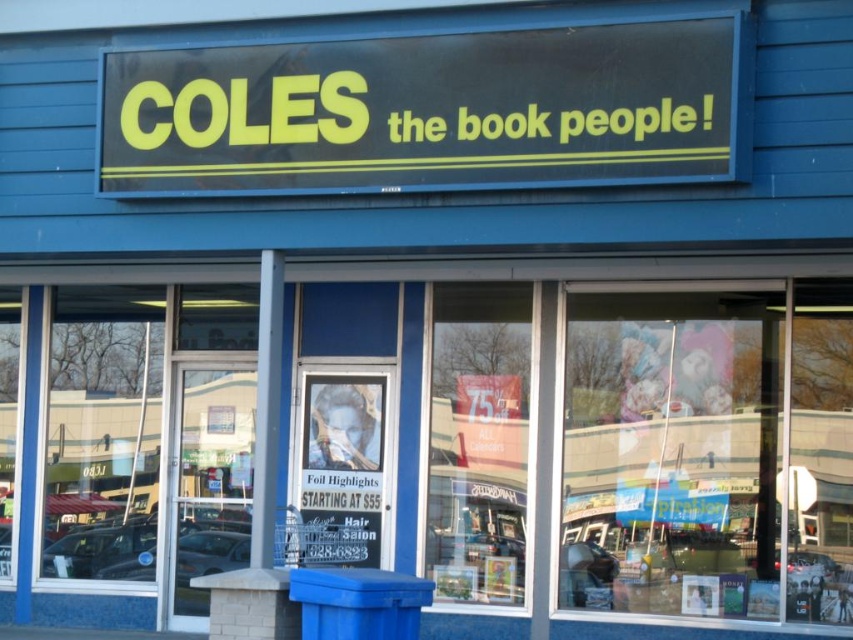
How much distance is there between transparent glass window at center and metallic poster at center?

A distance of 32.54 inches exists between transparent glass window at center and metallic poster at center.

Is transparent glass window at center behind metallic poster at center?

Yes, transparent glass window at center is further from the viewer.

Who is more distant from viewer, (451, 547) or (346, 540)?

Point (346, 540)

You are a GUI agent. You are given a task and a screenshot of the screen. Output one action in this format:
    pyautogui.click(x=<x>, y=<y>)
    Task: Click on the transparent glass window at center
    
    Given the screenshot: What is the action you would take?
    pyautogui.click(x=479, y=442)